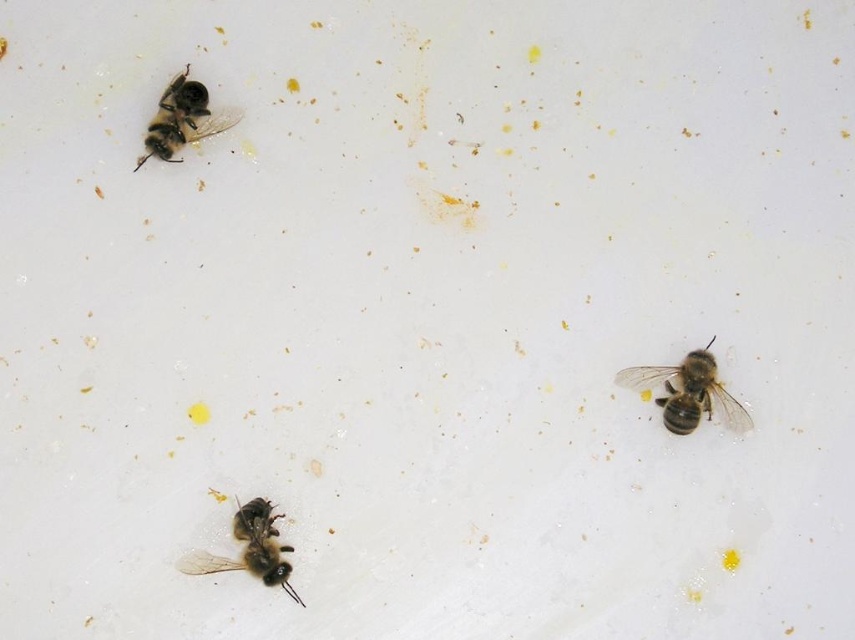
Question: Does brown fuzzy bee at right appear over brown fuzzy bee at upper left?

Choices:
 (A) yes
 (B) no

Answer: (B)

Question: Which of these objects is positioned farthest from the black fuzzy bee at lower left?

Choices:
 (A) brown fuzzy bee at upper left
 (B) brown fuzzy bee at right

Answer: (B)

Question: Which point is farther to the camera?

Choices:
 (A) (186, 564)
 (B) (746, 412)
 (C) (145, 147)

Answer: (B)

Question: Can you confirm if black fuzzy bee at lower left is positioned below brown fuzzy bee at upper left?

Choices:
 (A) yes
 (B) no

Answer: (A)

Question: Can you confirm if black fuzzy bee at lower left is thinner than brown fuzzy bee at upper left?

Choices:
 (A) yes
 (B) no

Answer: (B)

Question: Estimate the real-world distances between objects in this image. Which object is closer to the brown fuzzy bee at right?

Choices:
 (A) brown fuzzy bee at upper left
 (B) black fuzzy bee at lower left

Answer: (B)